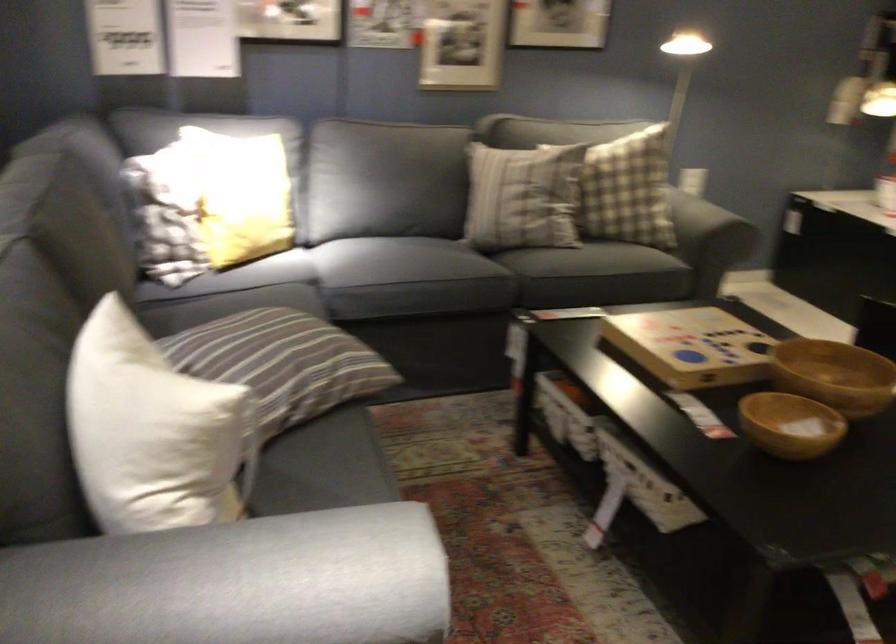
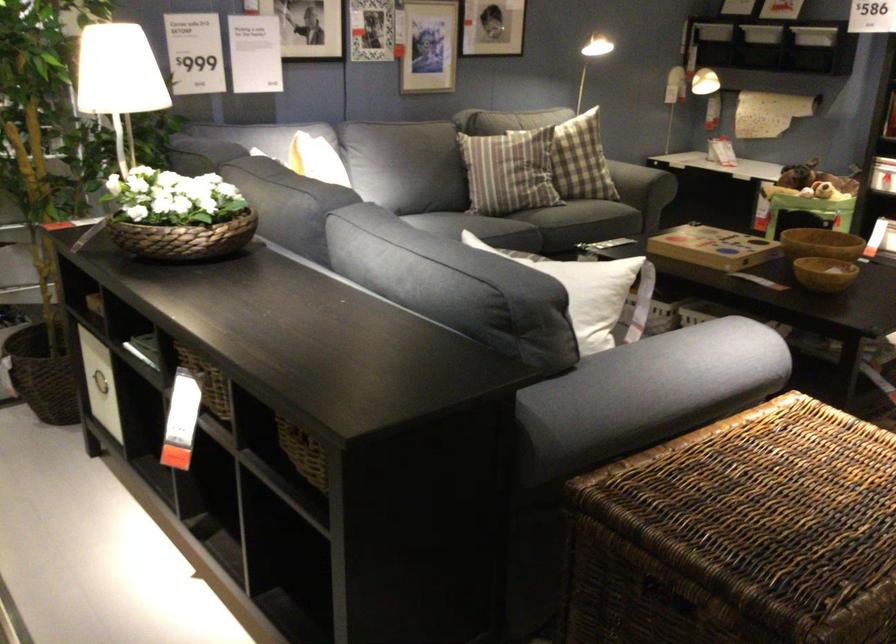
The point at (589, 181) is marked in the first image. Where is the corresponding point in the second image?

(581, 160)